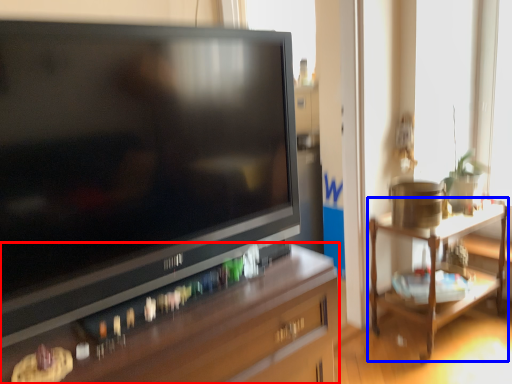
Question: Which point is further to the camera, desk (highlighted by a red box) or table (highlighted by a blue box)?

Choices:
 (A) desk
 (B) table

Answer: (B)